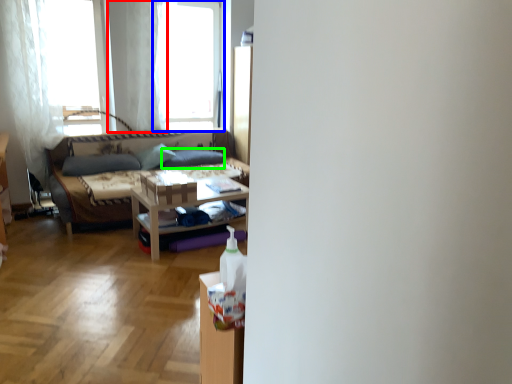
Question: Based on their relative distances, which object is nearer to curtain (highlighted by a red box)? Choose from window (highlighted by a blue box) and pillow (highlighted by a green box).

Choices:
 (A) window
 (B) pillow

Answer: (A)